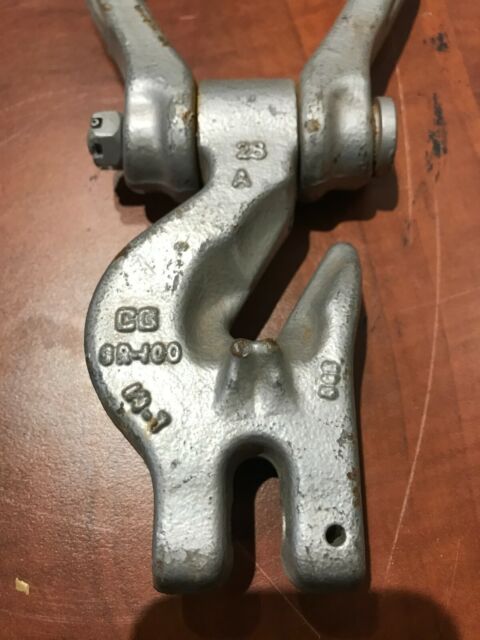
Where is `nick on wood`? nick on wood is located at coordinates (29, 588).